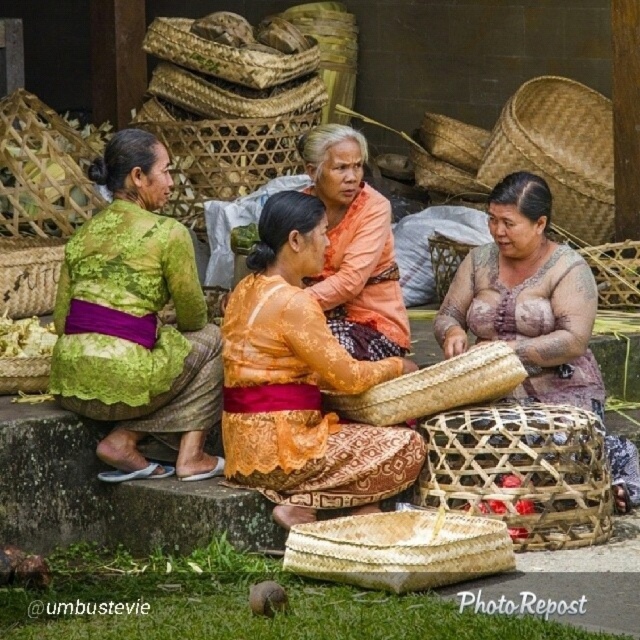
Question: Which is nearer to the natural woven basket at upper center?

Choices:
 (A) brown textured woven basket at center
 (B) woven bamboo basket at center

Answer: (B)

Question: Based on their relative distances, which object is nearer to the natural woven basket at upper center?

Choices:
 (A) green lace skirt at left
 (B) orange lace fabric at center

Answer: (A)

Question: Estimate the real-world distances between objects in this image. Which object is closer to the orange fabric skirt at center?

Choices:
 (A) natural woven basket at upper left
 (B) rope-like woven basket at left
 (C) brown textured woven basket at center
 (D) green lace skirt at left

Answer: (C)

Question: Can you confirm if orange fabric skirt at center is bigger than rope-like woven basket at left?

Choices:
 (A) no
 (B) yes

Answer: (A)

Question: Can you confirm if orange fabric skirt at center is positioned above rope-like woven basket at left?

Choices:
 (A) yes
 (B) no

Answer: (A)

Question: Is woven bamboo basket at upper center wider than rope-like woven basket at left?

Choices:
 (A) yes
 (B) no

Answer: (A)